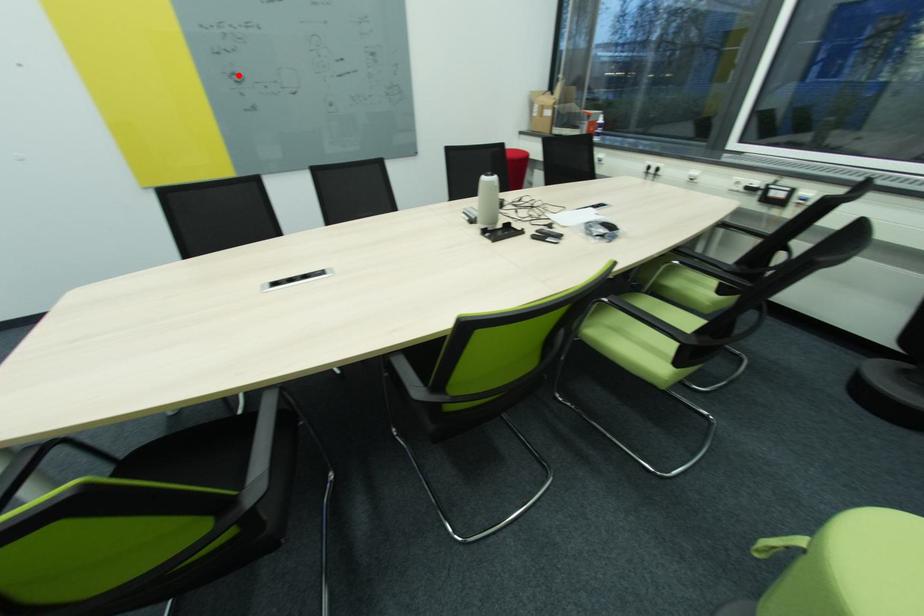
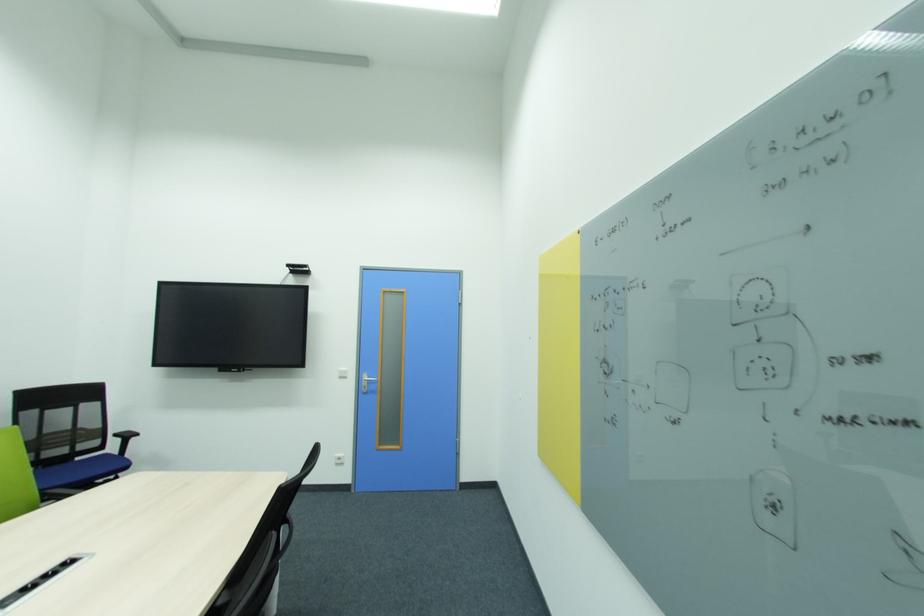
In the second image, find the point that corresponds to the highlighted location in the first image.

(610, 362)